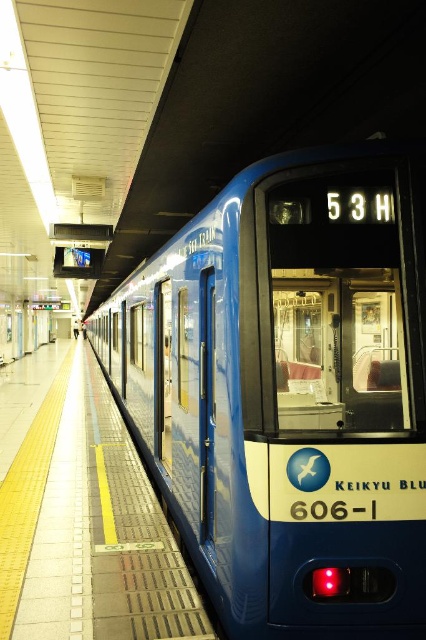
Question: Does blue glossy train at center lie in front of yellow rubber platform at center?

Choices:
 (A) no
 (B) yes

Answer: (B)

Question: Which point is farther to the camera?

Choices:
 (A) blue glossy train at center
 (B) yellow rubber platform at center

Answer: (B)

Question: Is blue glossy train at center wider than yellow rubber platform at center?

Choices:
 (A) yes
 (B) no

Answer: (B)

Question: Can you confirm if blue glossy train at center is positioned to the left of yellow rubber platform at center?

Choices:
 (A) no
 (B) yes

Answer: (A)